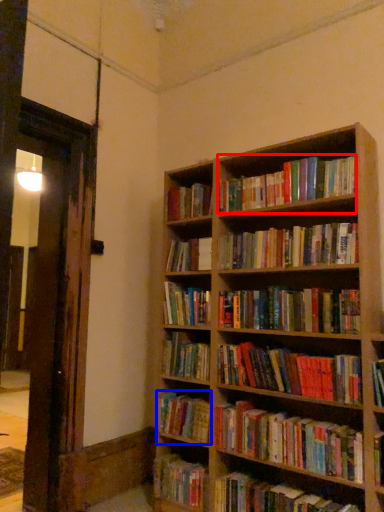
Question: Which point is further to the camera, book (highlighted by a red box) or book (highlighted by a blue box)?

Choices:
 (A) book
 (B) book

Answer: (B)